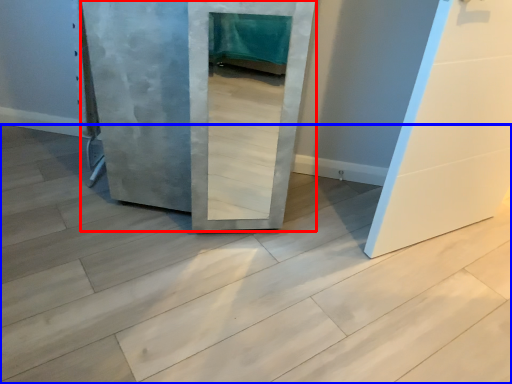
Question: Which object appears farthest to the camera in this image, door (highlighted by a red box) or concrete (highlighted by a blue box)?

Choices:
 (A) door
 (B) concrete

Answer: (A)